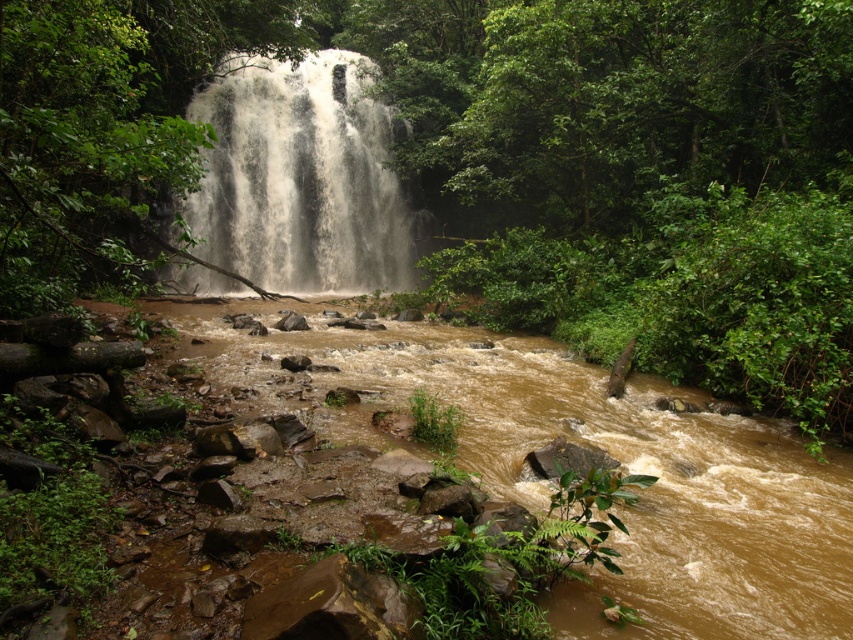
Question: Can you confirm if brown muddy stream at center is positioned to the right of white frothy water at center?

Choices:
 (A) no
 (B) yes

Answer: (B)

Question: Which point is closer to the camera?

Choices:
 (A) white frothy water at center
 (B) brown muddy stream at center

Answer: (B)

Question: Which point is closer to the camera?

Choices:
 (A) white frothy water at center
 (B) brown muddy stream at center

Answer: (B)

Question: Is brown muddy stream at center to the left of white frothy water at center from the viewer's perspective?

Choices:
 (A) yes
 (B) no

Answer: (B)

Question: Does brown muddy stream at center appear on the right side of white frothy water at center?

Choices:
 (A) yes
 (B) no

Answer: (A)